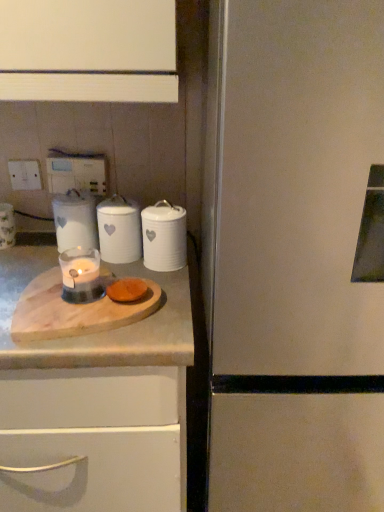
Question: From the image's perspective, is satin white refrigerator at right on top of white ceramic canister at center, which is counted as the third kitchen appliance, starting from the left?

Choices:
 (A) no
 (B) yes

Answer: (A)

Question: From a real-world perspective, is satin white refrigerator at right on white ceramic canister at center, the first kitchen appliance when ordered from right to left?

Choices:
 (A) yes
 (B) no

Answer: (B)

Question: Is the surface of satin white refrigerator at right in direct contact with white ceramic canister at center, the first kitchen appliance when ordered from right to left?

Choices:
 (A) yes
 (B) no

Answer: (B)

Question: Does satin white refrigerator at right appear on the right side of white ceramic canister at center, the first kitchen appliance when ordered from right to left?

Choices:
 (A) yes
 (B) no

Answer: (A)

Question: Can you confirm if satin white refrigerator at right is shorter than white ceramic canister at center, the first kitchen appliance when ordered from right to left?

Choices:
 (A) no
 (B) yes

Answer: (A)

Question: Would you say white plastic electric outlet at upper left, the first electric outlet from the left, is inside or outside translucent glass candle at center?

Choices:
 (A) inside
 (B) outside

Answer: (B)

Question: Considering the positions of white plastic electric outlet at upper left, the first electric outlet from the left, and translucent glass candle at center in the image, is white plastic electric outlet at upper left, the first electric outlet from the left, bigger or smaller than translucent glass candle at center?

Choices:
 (A) big
 (B) small

Answer: (B)

Question: Is white plastic electric outlet at upper left, which is the 2th electric outlet from right to left, taller or shorter than translucent glass candle at center?

Choices:
 (A) tall
 (B) short

Answer: (A)

Question: From a real-world perspective, is white plastic electric outlet at upper left, which is the 2th electric outlet from right to left, physically located above or below translucent glass candle at center?

Choices:
 (A) above
 (B) below

Answer: (A)

Question: Is white ceramic canister at center, which appears as the 2th kitchen appliance when viewed from the left, wider or thinner than white plastic electric outlet at upper left, the first electric outlet from the left?

Choices:
 (A) wide
 (B) thin

Answer: (A)

Question: Based on their sizes in the image, would you say white ceramic canister at center, which appears as the 2th kitchen appliance when viewed from the left, is bigger or smaller than white plastic electric outlet at upper left, the first electric outlet from the left?

Choices:
 (A) big
 (B) small

Answer: (A)

Question: Is white ceramic canister at center, the second kitchen appliance viewed from the right, in front of or behind white plastic electric outlet at upper left, the first electric outlet from the left, in the image?

Choices:
 (A) front
 (B) behind

Answer: (A)

Question: Do you think white ceramic canister at center, which appears as the 2th kitchen appliance when viewed from the left, is within white plastic electric outlet at upper left, which is the 2th electric outlet from right to left, or outside of it?

Choices:
 (A) inside
 (B) outside

Answer: (B)

Question: Looking at the image, does white ceramic canister at center, the second kitchen appliance viewed from the right, seem bigger or smaller compared to white ceramic candle at center, which is the 1th kitchen appliance from left to right?

Choices:
 (A) small
 (B) big

Answer: (A)

Question: Does point (105, 251) appear closer or farther from the camera than point (92, 224)?

Choices:
 (A) farther
 (B) closer

Answer: (B)